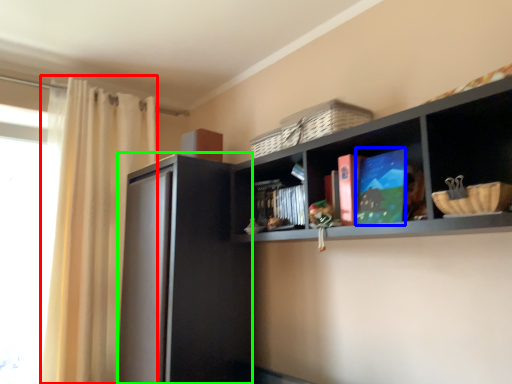
Question: Based on their relative distances, which object is nearer to curtain (highlighted by a red box)? Choose from book (highlighted by a blue box) and screen door (highlighted by a green box).

Choices:
 (A) book
 (B) screen door

Answer: (B)